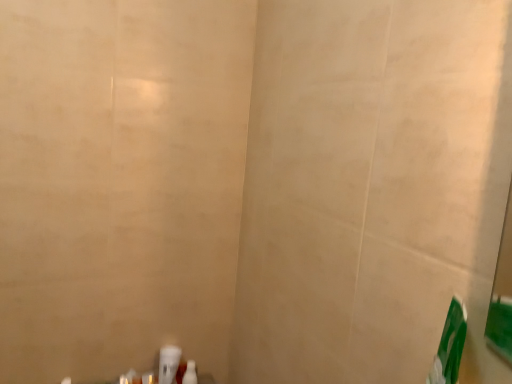
Measure the distance between white plastic toothbrush at lower center and camera.

3.61 feet.

Describe the element at coordinates (168, 363) in the screenshot. I see `white plastic toothbrush at lower center` at that location.

This screenshot has width=512, height=384. What are the coordinates of `white plastic toothbrush at lower center` in the screenshot? It's located at (168, 363).

Where is `white plastic toothbrush at lower center`? The height and width of the screenshot is (384, 512). white plastic toothbrush at lower center is located at coordinates (168, 363).